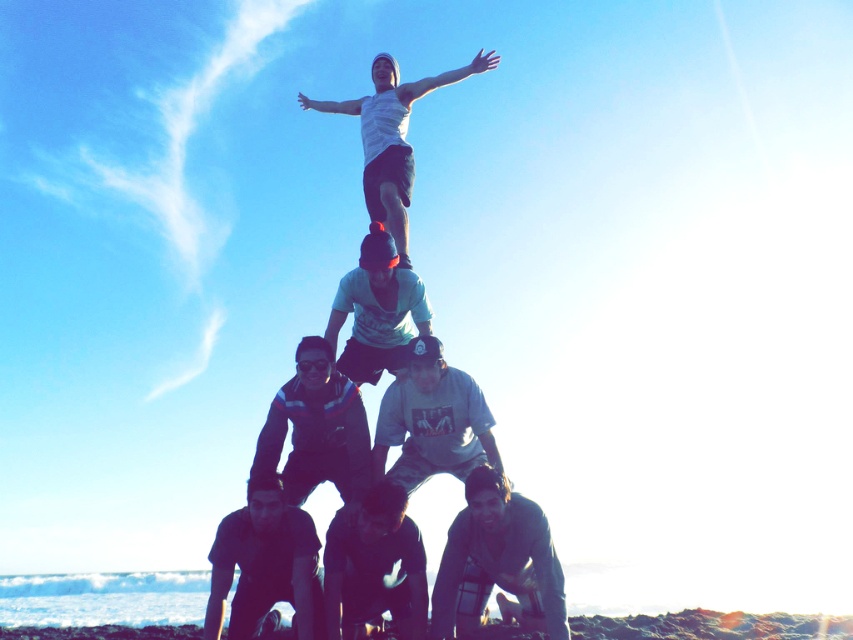
Question: Where is dark gray fabric at lower right located in relation to white cotton shirt at center in the image?

Choices:
 (A) right
 (B) left

Answer: (A)

Question: Is dark blue jacket at center below dark blue shirt at center?

Choices:
 (A) no
 (B) yes

Answer: (A)

Question: Does dark gray fabric shirt at lower left appear over white matte tank top at upper center?

Choices:
 (A) yes
 (B) no

Answer: (B)

Question: Among these objects, which one is nearest to the camera?

Choices:
 (A) dark blue jacket at center
 (B) dark blue shirt at center

Answer: (B)

Question: Which object is the farthest from the light blue t-shirt at center?

Choices:
 (A) dark gray fabric shirt at lower left
 (B) white matte tank top at upper center

Answer: (A)

Question: Which object is closer to the camera taking this photo?

Choices:
 (A) light blue t-shirt at center
 (B) dark gray fabric shirt at lower left
 (C) white matte tank top at upper center
 (D) dark gray fabric at lower right

Answer: (D)